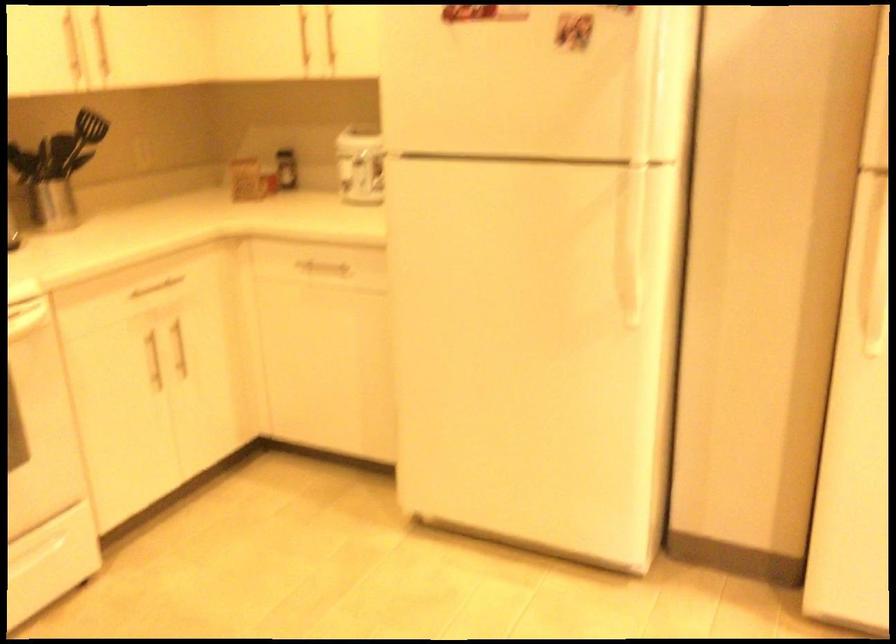
Find the location of a particular element. This screenshot has width=896, height=644. oven door handle is located at coordinates (37, 553).